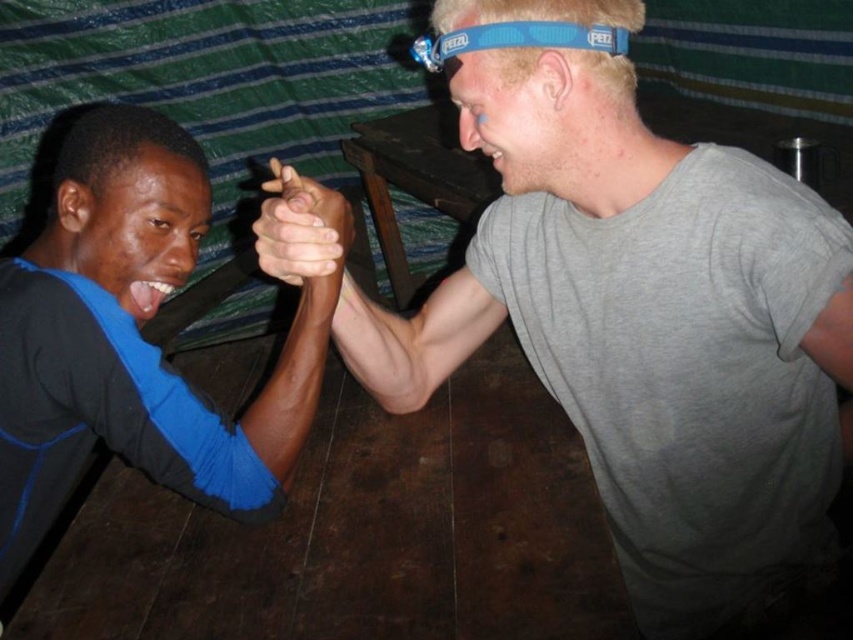
Question: Among these points, which one is nearest to the camera?

Choices:
 (A) (688, 458)
 (B) (106, 381)
 (C) (451, 36)
 (D) (276, 243)

Answer: (C)

Question: Can you confirm if gray matte t-shirt at center is positioned below blue rubber headband at upper center?

Choices:
 (A) no
 (B) yes

Answer: (B)

Question: Can you confirm if blue fabric shirt at left is bigger than smooth skin hands at center?

Choices:
 (A) yes
 (B) no

Answer: (A)

Question: Does blue fabric shirt at left appear over blue rubber headband at upper center?

Choices:
 (A) no
 (B) yes

Answer: (A)

Question: Which object is farther from the camera taking this photo?

Choices:
 (A) gray matte t-shirt at center
 (B) blue fabric shirt at left

Answer: (B)

Question: Which of the following is the closest to the observer?

Choices:
 (A) (270, 192)
 (B) (192, 410)

Answer: (B)